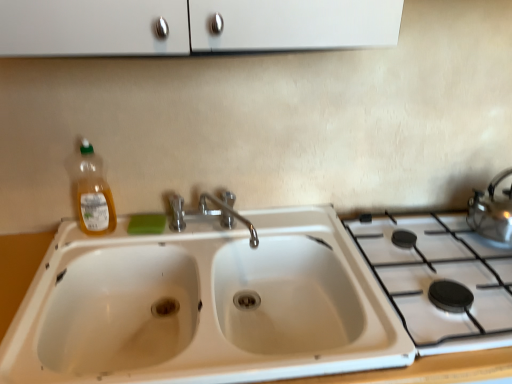
Question: Is white ceramic gas stove at right beside chrome metallic faucet at center?

Choices:
 (A) no
 (B) yes

Answer: (A)

Question: From the image's perspective, is white ceramic gas stove at right located beneath chrome metallic faucet at center?

Choices:
 (A) no
 (B) yes

Answer: (B)

Question: Is white ceramic gas stove at right completely or partially outside of chrome metallic faucet at center?

Choices:
 (A) no
 (B) yes

Answer: (B)

Question: Does white ceramic gas stove at right lie behind chrome metallic faucet at center?

Choices:
 (A) yes
 (B) no

Answer: (B)

Question: Considering the relative sizes of white ceramic gas stove at right and chrome metallic faucet at center in the image provided, is white ceramic gas stove at right thinner than chrome metallic faucet at center?

Choices:
 (A) no
 (B) yes

Answer: (A)

Question: Does white ceramic gas stove at right have a larger size compared to chrome metallic faucet at center?

Choices:
 (A) no
 (B) yes

Answer: (B)

Question: Is white ceramic gas stove at right further to camera compared to translucent plastic bottle at left?

Choices:
 (A) no
 (B) yes

Answer: (A)

Question: Can you confirm if white ceramic gas stove at right is positioned to the right of translucent plastic bottle at left?

Choices:
 (A) yes
 (B) no

Answer: (A)

Question: From the image's perspective, would you say white ceramic gas stove at right is positioned over translucent plastic bottle at left?

Choices:
 (A) no
 (B) yes

Answer: (A)

Question: Are white ceramic gas stove at right and translucent plastic bottle at left making contact?

Choices:
 (A) yes
 (B) no

Answer: (B)

Question: From a real-world perspective, is white ceramic gas stove at right positioned under translucent plastic bottle at left based on gravity?

Choices:
 (A) no
 (B) yes

Answer: (B)

Question: Does white ceramic gas stove at right have a larger size compared to translucent plastic bottle at left?

Choices:
 (A) yes
 (B) no

Answer: (A)

Question: From a real-world perspective, is satin silver kettle at right located beneath chrome metallic faucet at center?

Choices:
 (A) no
 (B) yes

Answer: (A)